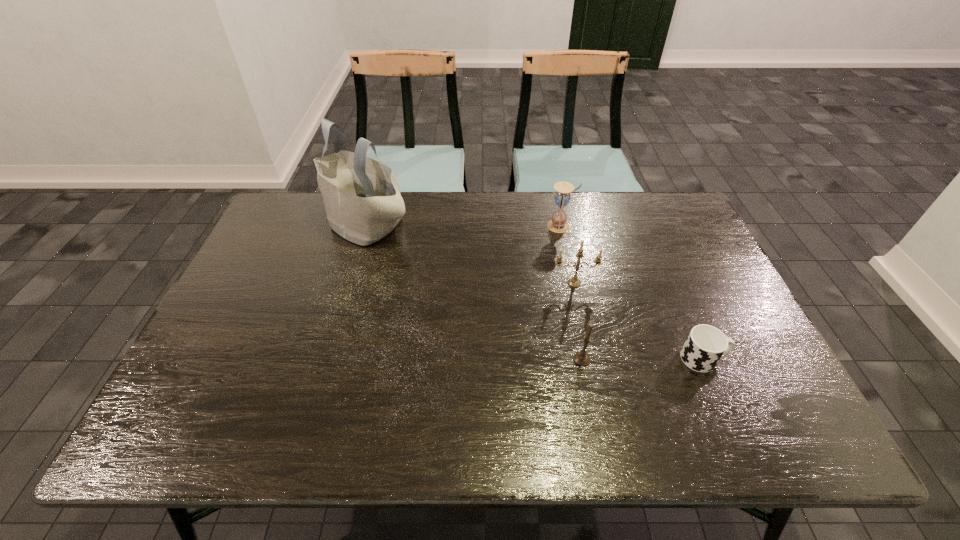
The width and height of the screenshot is (960, 540). Find the location of `free space that is in between the cup and the second shortest object`. free space that is in between the cup and the second shortest object is located at coordinates (642, 359).

Where is `empty space between the hourglass and the third nearest object`? The width and height of the screenshot is (960, 540). empty space between the hourglass and the third nearest object is located at coordinates pos(567,254).

Locate an element on the screen. The height and width of the screenshot is (540, 960). free space between the nearer candle and the farther candle is located at coordinates (578, 321).

Choose which object is the third nearest neighbor to the hourglass. Please provide its 2D coordinates. Your answer should be formatted as a tuple, i.e. [(x, y)], where the tuple contains the x and y coordinates of a point satisfying the conditions above.

[(581, 358)]

Point out which object is positioned as the second nearest to the nearer candle. Please provide its 2D coordinates. Your answer should be formatted as a tuple, i.e. [(x, y)], where the tuple contains the x and y coordinates of a point satisfying the conditions above.

[(705, 345)]

Locate an element on the screen. This screenshot has width=960, height=540. vacant region that satisfies the following two spatial constraints: 1. on the back side of the hourglass; 2. on the left side of the shorter candle is located at coordinates (556, 226).

You are a GUI agent. You are given a task and a screenshot of the screen. Output one action in this format:
    pyautogui.click(x=<x>, y=<y>)
    Task: Click on the vacant space that satisfies the following two spatial constraints: 1. on the front side of the hourglass; 2. on the left side of the farther candle
    
    Given the screenshot: What is the action you would take?
    pyautogui.click(x=572, y=283)

Find the location of a particular element. blank area in the image that satisfies the following two spatial constraints: 1. on the front side of the shopping bag; 2. on the right side of the hourglass is located at coordinates (365, 226).